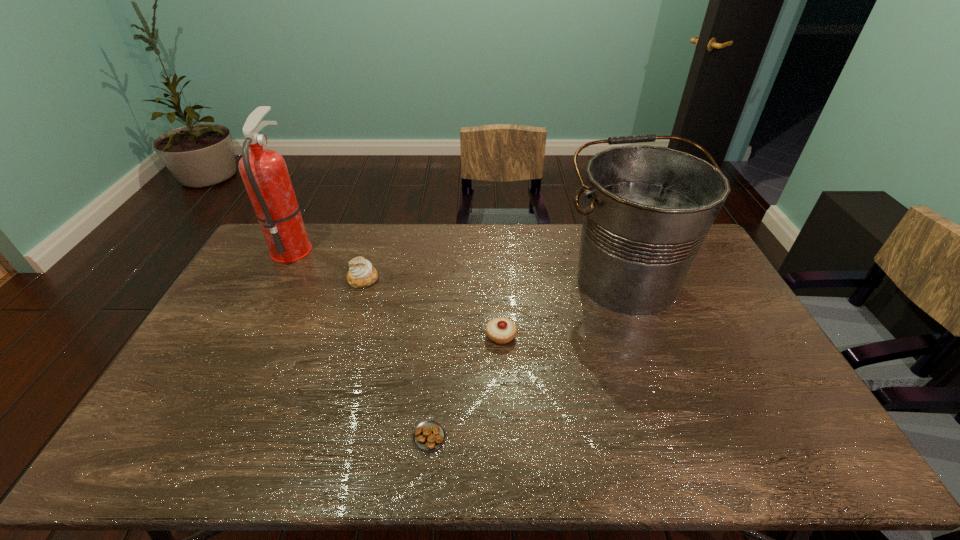
You are a GUI agent. You are given a task and a screenshot of the screen. Output one action in this format:
    pyautogui.click(x=<x>, y=<y>)
    Task: Click on the vacant space that satisfies the following two spatial constraints: 1. with the handle and hose on the second object from left to right; 2. on the left side of the leftmost object
    This screenshot has width=960, height=540.
    Given the screenshot: What is the action you would take?
    pyautogui.click(x=276, y=279)

I want to click on vacant space that satisfies the following two spatial constraints: 1. with the handle and hose on the fire extinguisher; 2. on the right side of the fourth object from right to left, so click(x=276, y=279).

I want to click on free space in the image that satisfies the following two spatial constraints: 1. with the handle and hose on the leftmost pastry; 2. on the right side of the leftmost object, so click(276, 279).

What are the coordinates of `vacant space that satisfies the following two spatial constraints: 1. on the front side of the farthest pastry; 2. on the right side of the rightmost pastry` in the screenshot? It's located at (347, 335).

Where is `vacant area in the image that satisfies the following two spatial constraints: 1. on the front side of the rightmost object; 2. on the left side of the fourth object from right to left`? This screenshot has width=960, height=540. vacant area in the image that satisfies the following two spatial constraints: 1. on the front side of the rightmost object; 2. on the left side of the fourth object from right to left is located at coordinates (363, 280).

Locate an element on the screen. This screenshot has width=960, height=540. free location that satisfies the following two spatial constraints: 1. with the handle and hose on the fourth farthest object; 2. on the right side of the fire extinguisher is located at coordinates (247, 335).